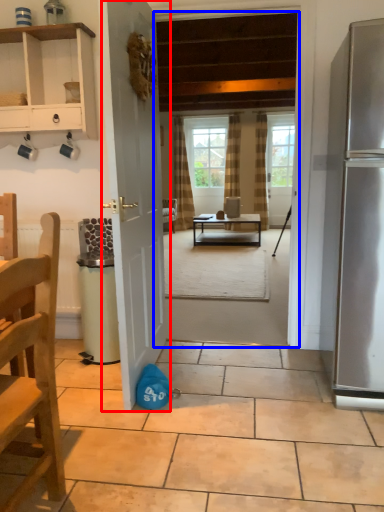
Question: Among these objects, which one is farthest to the camera, door (highlighted by a red box) or terrace (highlighted by a blue box)?

Choices:
 (A) door
 (B) terrace

Answer: (B)